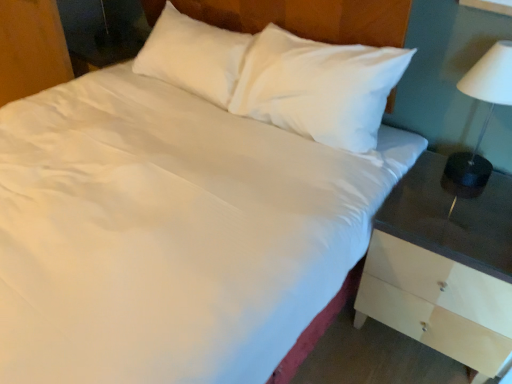
Question: From the image's perspective, is white wood nightstand at right under white glossy lampshade at right?

Choices:
 (A) no
 (B) yes

Answer: (B)

Question: Is white wood nightstand at right positioned behind white glossy lampshade at right?

Choices:
 (A) yes
 (B) no

Answer: (B)

Question: Does white wood nightstand at right appear on the left side of white glossy lampshade at right?

Choices:
 (A) no
 (B) yes

Answer: (B)

Question: Is white wood nightstand at right at the right side of white glossy lampshade at right?

Choices:
 (A) yes
 (B) no

Answer: (B)

Question: Can you confirm if white wood nightstand at right is thinner than white glossy lampshade at right?

Choices:
 (A) yes
 (B) no

Answer: (B)

Question: From a real-world perspective, is white wood nightstand at right on white glossy lampshade at right?

Choices:
 (A) no
 (B) yes

Answer: (A)

Question: Does white glossy lampshade at right touch white wood nightstand at right?

Choices:
 (A) yes
 (B) no

Answer: (B)

Question: From a real-world perspective, is white glossy lampshade at right on white wood nightstand at right?

Choices:
 (A) no
 (B) yes

Answer: (B)

Question: Would you say white glossy lampshade at right is outside white wood nightstand at right?

Choices:
 (A) no
 (B) yes

Answer: (B)

Question: Can you confirm if white glossy lampshade at right is thinner than white wood nightstand at right?

Choices:
 (A) no
 (B) yes

Answer: (B)

Question: From the image's perspective, is white glossy lampshade at right below white wood nightstand at right?

Choices:
 (A) no
 (B) yes

Answer: (A)

Question: Can you confirm if white glossy lampshade at right is shorter than white wood nightstand at right?

Choices:
 (A) no
 (B) yes

Answer: (B)

Question: From a real-world perspective, is wooden dresser at lower left over white glossy lampshade at right?

Choices:
 (A) no
 (B) yes

Answer: (A)